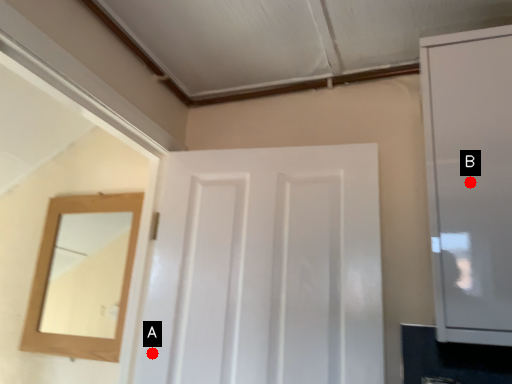
Question: Two points are circled on the image, labeled by A and B beside each circle. Among these points, which one is farthest from the camera?

Choices:
 (A) A is further
 (B) B is further

Answer: (A)